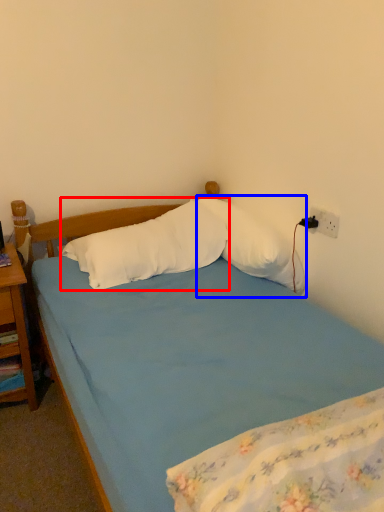
Question: Among these objects, which one is farthest to the camera, pillow (highlighted by a red box) or pillow (highlighted by a blue box)?

Choices:
 (A) pillow
 (B) pillow

Answer: (B)